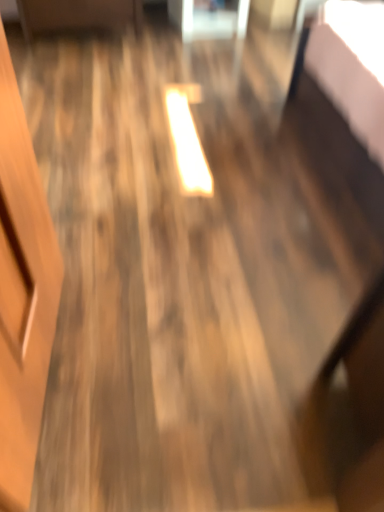
The image size is (384, 512). I want to click on spots to the right of wooden door at left, so click(x=182, y=367).